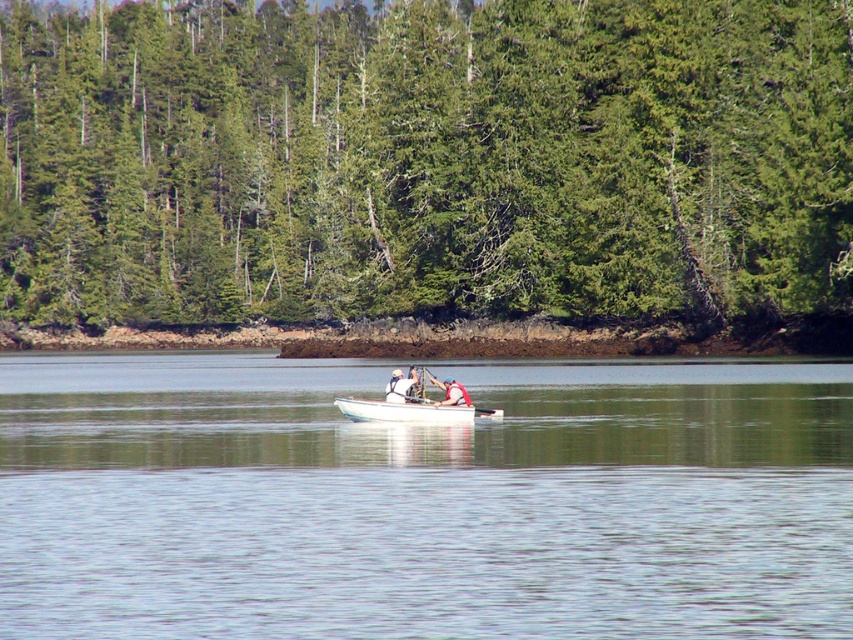
You are planning to take a photo of the white matte boat at center and the green textured trees at center. Which object will appear larger in your photo?

The green textured trees at center will appear larger in the photo because they are bigger than the white matte boat at center.

You are standing on the lakeside and see the white matte boat at center and the green textured trees at center. Which object is closer to you?

The green textured trees at center are closer to you because the white matte boat at center is behind them.

You are standing on the dock and see the clear water at center and the white fabric at center. Which object is located to the right of the other?

The clear water at center is to the right of the white fabric at center.